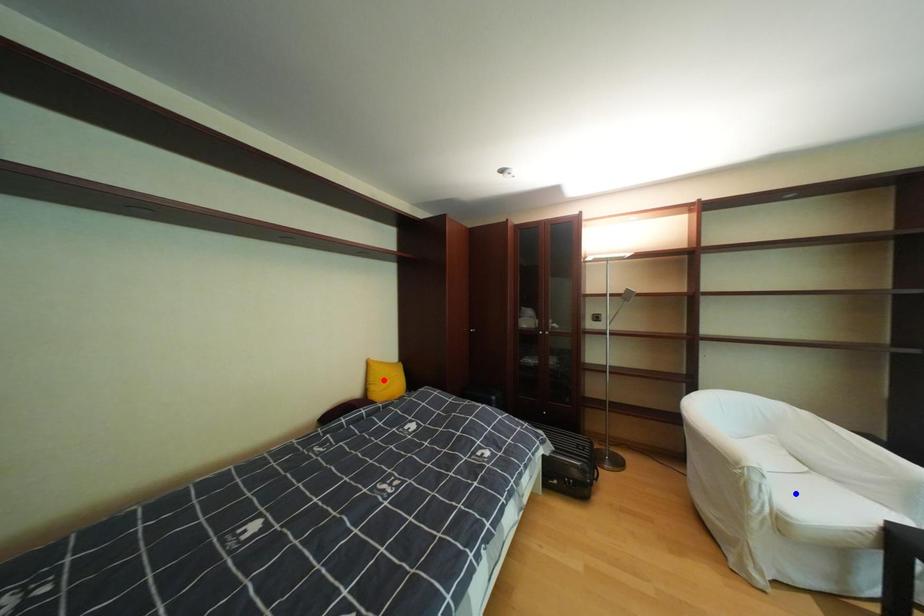
Question: In the image, two points are highlighted. Which point is nearer to the camera? Reply with the corresponding letter.

Choices:
 (A) blue point
 (B) red point

Answer: (A)